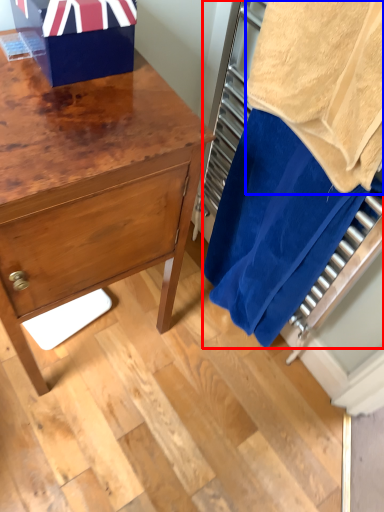
Question: Which object appears closest to the camera in this image, laundry (highlighted by a red box) or bath towel (highlighted by a blue box)?

Choices:
 (A) laundry
 (B) bath towel

Answer: (B)